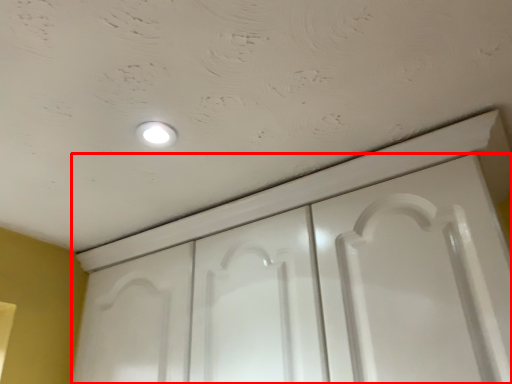
Question: Considering the relative positions of door (annotated by the red box) and dot in the image provided, where is door (annotated by the red box) located with respect to the staircase?

Choices:
 (A) left
 (B) right

Answer: (B)